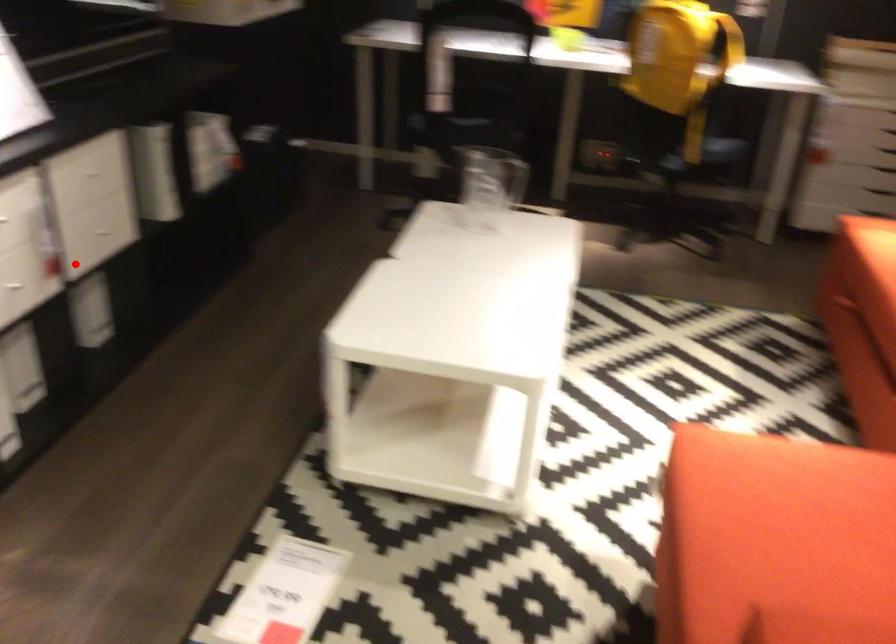
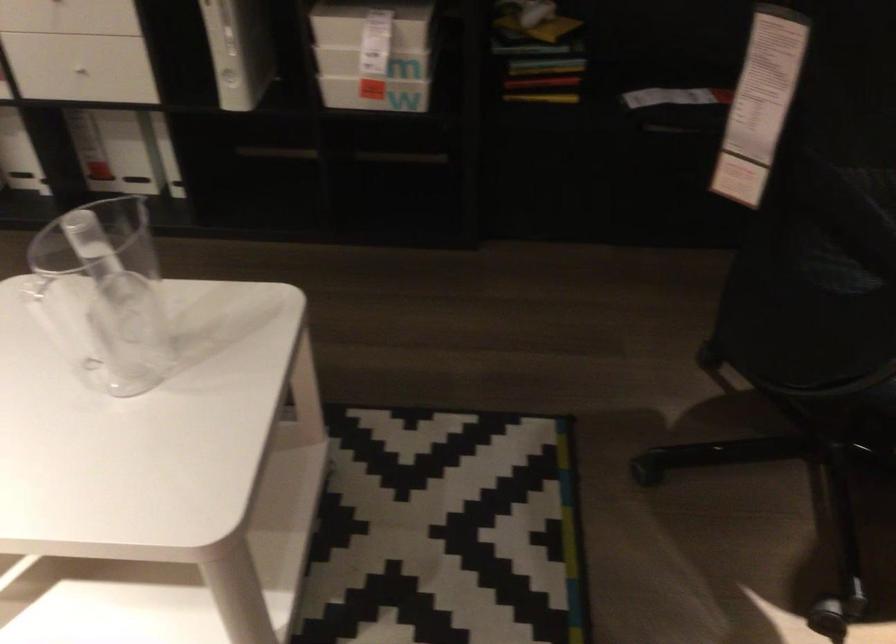
Question: I am providing you with two images of the same scene from different viewpoints. Given a red point in image1, look at the same physical point in image2. Is it:

Choices:
 (A) Closer to the viewpoint
 (B) Farther from the viewpoint

Answer: (A)